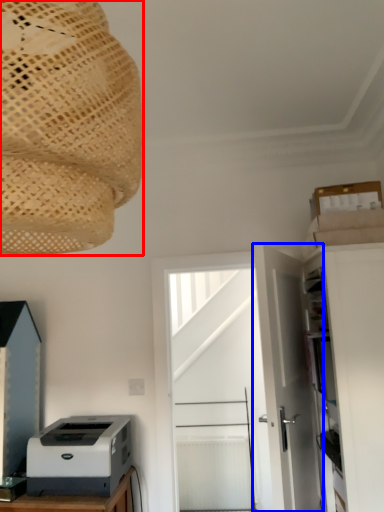
Question: Which point is closer to the camera, lamp (highlighted by a red box) or door (highlighted by a blue box)?

Choices:
 (A) lamp
 (B) door

Answer: (A)